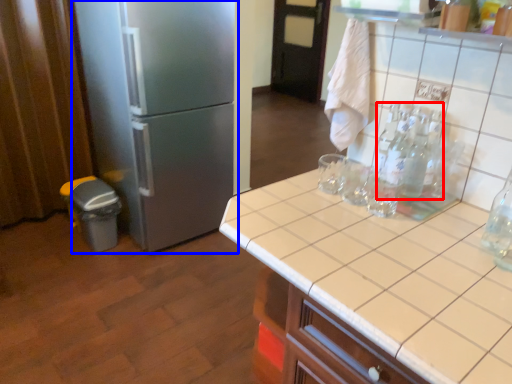
Question: Among these objects, which one is farthest to the camera, bottle (highlighted by a red box) or refrigerator (highlighted by a blue box)?

Choices:
 (A) bottle
 (B) refrigerator

Answer: (B)